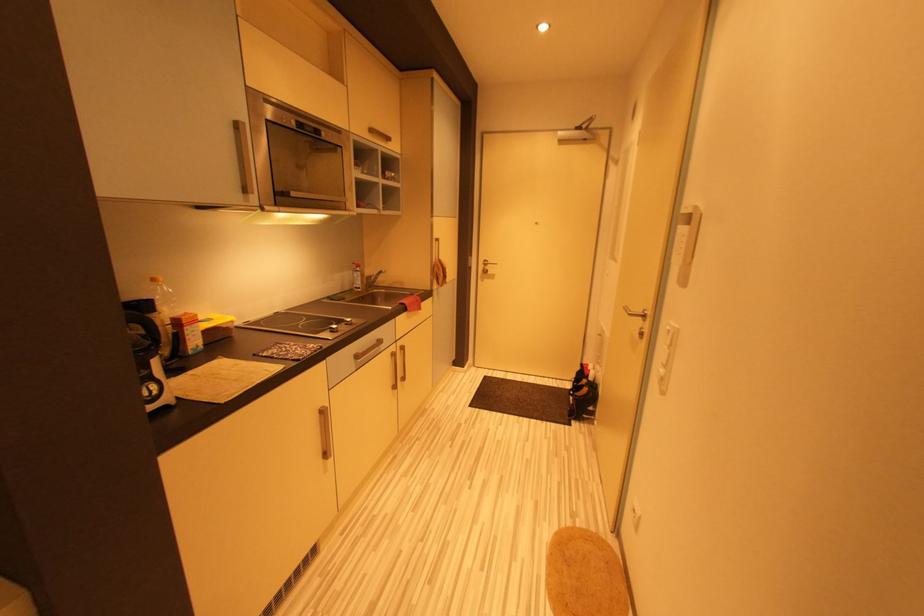
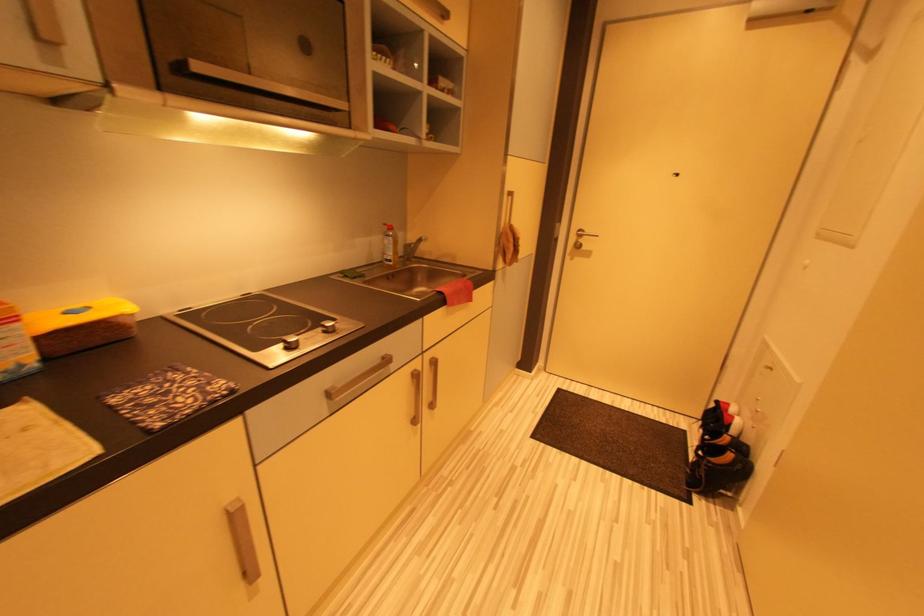
Question: Based on the continuous images, in which direction is the camera rotating? Reply with the corresponding letter.

Choices:
 (A) Left
 (B) Right
 (C) Up
 (D) Down

Answer: (A)